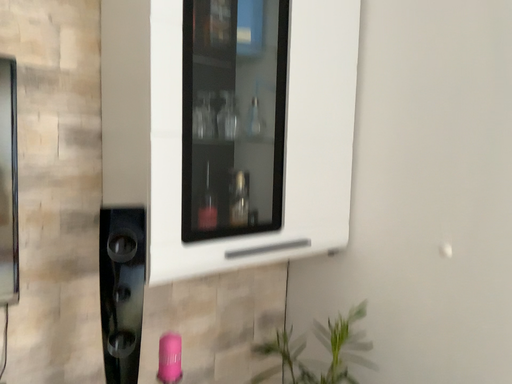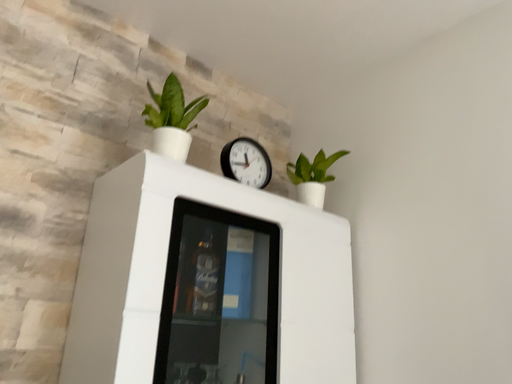
Question: Which way did the camera rotate in the video?

Choices:
 (A) rotated downward
 (B) rotated upward

Answer: (B)